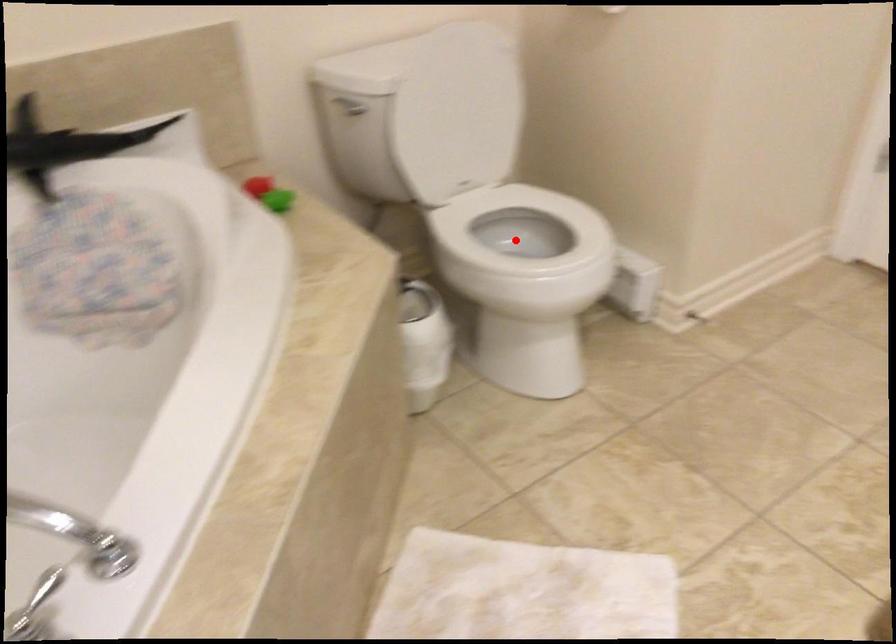
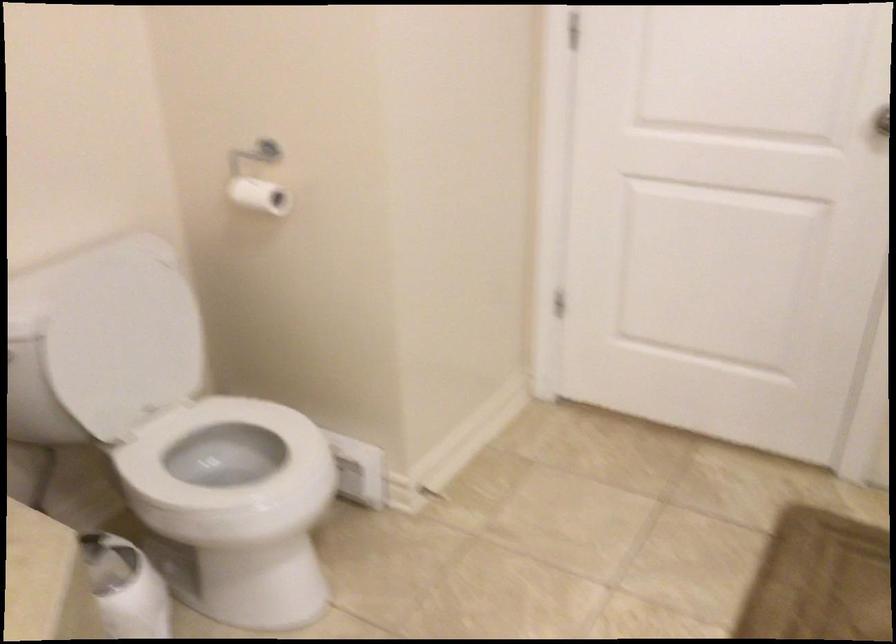
In the second image, find the point that corresponds to the highlighted location in the first image.

(226, 453)